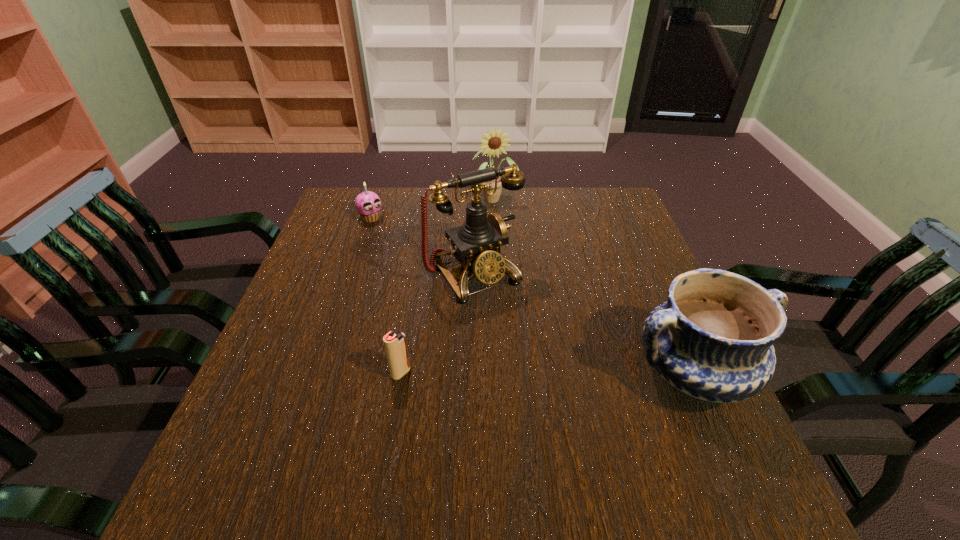
You are a GUI agent. You are given a task and a screenshot of the screen. Output one action in this format:
    pyautogui.click(x=<x>, y=<y>)
    Task: Click on the igniter
    The height and width of the screenshot is (540, 960).
    Given the screenshot: What is the action you would take?
    pyautogui.click(x=395, y=345)

The width and height of the screenshot is (960, 540). What are the coordinates of `pottery` in the screenshot? It's located at (713, 339).

Where is `the third shortest object`? Image resolution: width=960 pixels, height=540 pixels. the third shortest object is located at coordinates (713, 339).

Where is `the third farthest object`? the third farthest object is located at coordinates (476, 244).

Where is `telephone`? The width and height of the screenshot is (960, 540). telephone is located at coordinates (476, 244).

Identify the location of cupcake. (368, 204).

Find the location of `the fourth nearest object`. the fourth nearest object is located at coordinates (368, 204).

This screenshot has height=540, width=960. Identify the location of the second tallest object. (495, 143).

Locate an element on the screen. the farthest object is located at coordinates (495, 143).

Where is `vacant space located 0.140m on the back of the fourth object from right to left`? vacant space located 0.140m on the back of the fourth object from right to left is located at coordinates (410, 316).